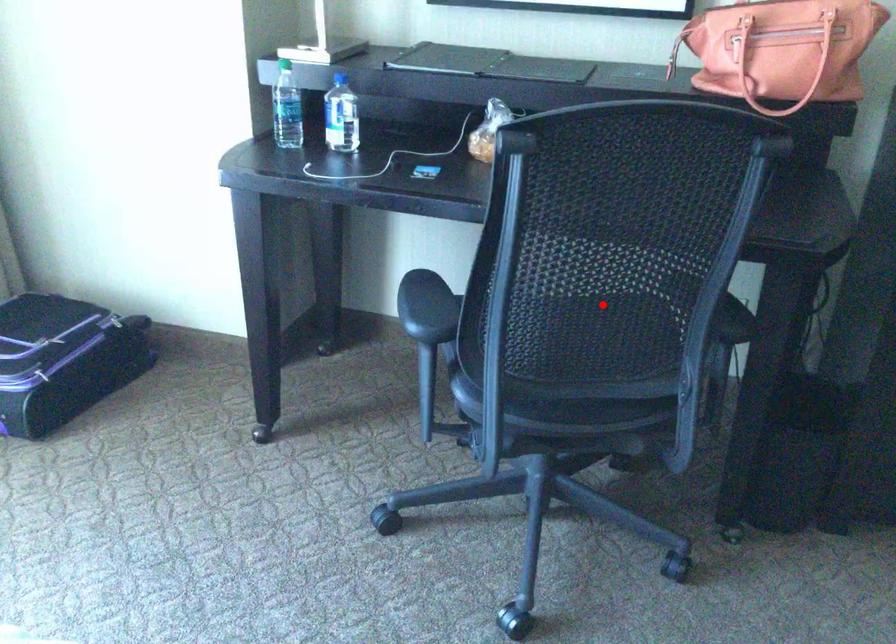
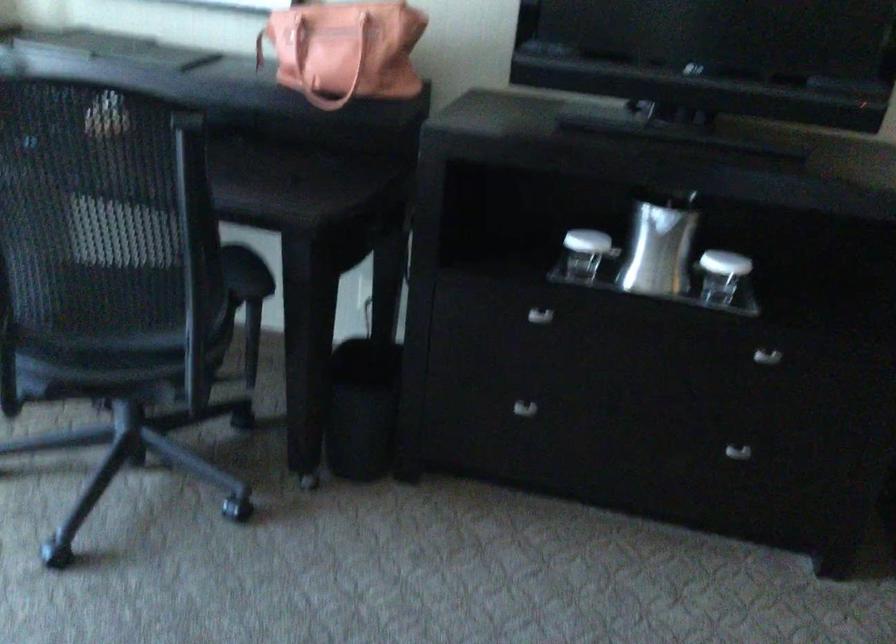
Locate, in the second image, the point that corresponds to the highlighted location in the first image.

(107, 265)